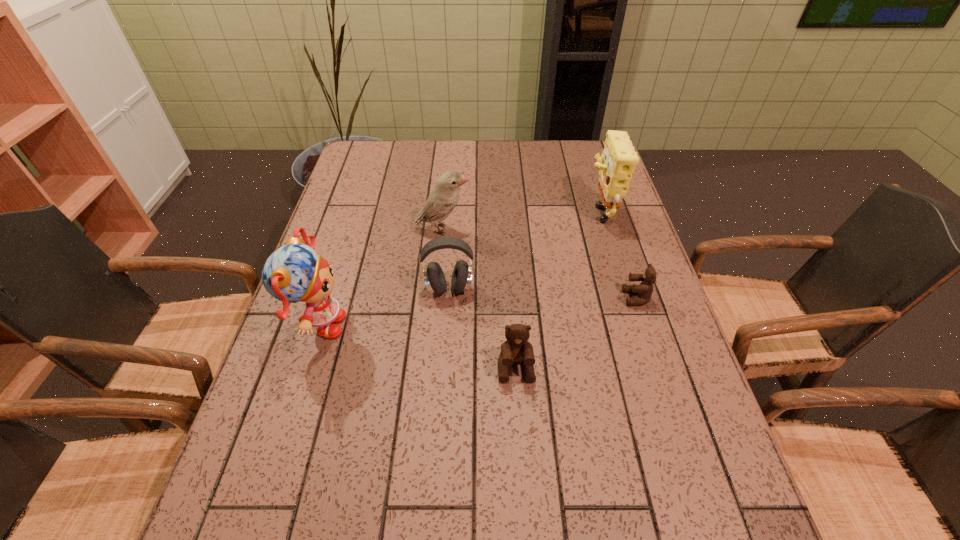
Please point a free position for a teddy bear on the left. Please provide its 2D coordinates. Your answer should be formatted as a tuple, i.e. [(x, y)], where the tuple contains the x and y coordinates of a point satisfying the conditions above.

[(353, 463)]